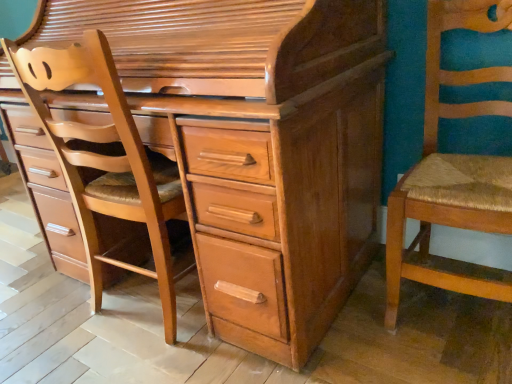
Question: From the image's perspective, would you say light brown wood chest of drawers at center is shown under light brown wood chair at left?

Choices:
 (A) no
 (B) yes

Answer: (A)

Question: Is light brown wood chest of drawers at center shorter than light brown wood chair at left?

Choices:
 (A) yes
 (B) no

Answer: (B)

Question: Does light brown wood chest of drawers at center have a greater width compared to light brown wood chair at left?

Choices:
 (A) no
 (B) yes

Answer: (B)

Question: Does light brown wood chest of drawers at center appear on the right side of light brown wood chair at left?

Choices:
 (A) no
 (B) yes

Answer: (B)

Question: Is light brown wood chest of drawers at center oriented away from light brown wood chair at left?

Choices:
 (A) yes
 (B) no

Answer: (A)

Question: Can you see light brown wood chest of drawers at center touching light brown wood chair at left?

Choices:
 (A) yes
 (B) no

Answer: (B)

Question: Can you confirm if light brown wood chair at left is smaller than light brown wood chest of drawers at center?

Choices:
 (A) yes
 (B) no

Answer: (A)

Question: Is light brown wood chair at left further to camera compared to light brown wood chest of drawers at center?

Choices:
 (A) no
 (B) yes

Answer: (B)

Question: Is light brown wood chair at left bigger than light brown wood chest of drawers at center?

Choices:
 (A) yes
 (B) no

Answer: (B)

Question: Can you confirm if light brown wood chair at left is thinner than light brown wood chest of drawers at center?

Choices:
 (A) no
 (B) yes

Answer: (B)

Question: Is light brown wood chair at left to the right of light brown wood chest of drawers at center from the viewer's perspective?

Choices:
 (A) yes
 (B) no

Answer: (B)

Question: Does light brown wood chair at left have a greater width compared to light brown wood chest of drawers at center?

Choices:
 (A) yes
 (B) no

Answer: (B)

Question: Can you confirm if light brown wood chest of drawers at center is taller than wooden woven seat at right?

Choices:
 (A) yes
 (B) no

Answer: (A)